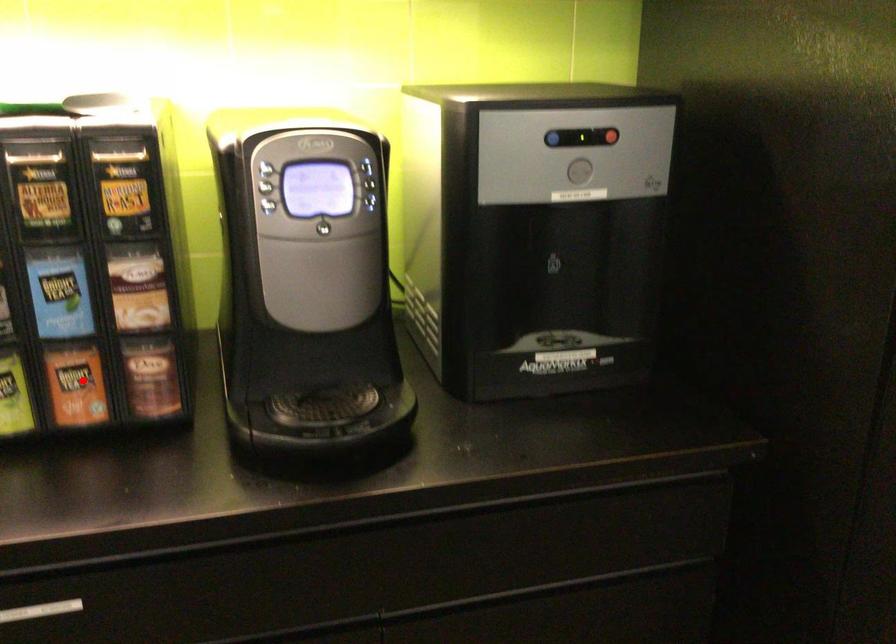
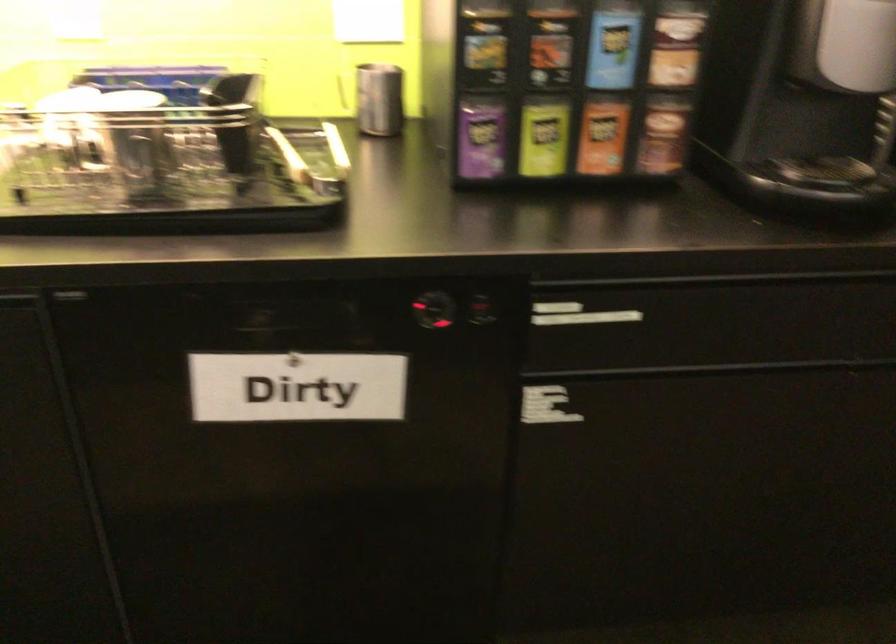
Question: I am providing you with two images of the same scene from different viewpoints. In image1, a red point is highlighted. Considering the same 3D point in image2, which of the following is correct?

Choices:
 (A) It is closer
 (B) It is farther

Answer: (B)